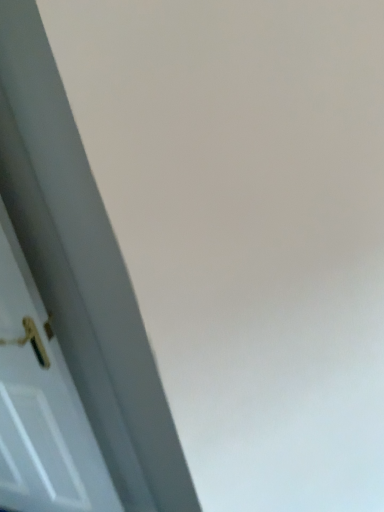
What do you see at coordinates (41, 405) in the screenshot?
I see `white glossy door handle at left` at bounding box center [41, 405].

Find the location of a particular element. white glossy door handle at left is located at coordinates (41, 405).

Where is `white glossy door handle at left`? The height and width of the screenshot is (512, 384). white glossy door handle at left is located at coordinates (41, 405).